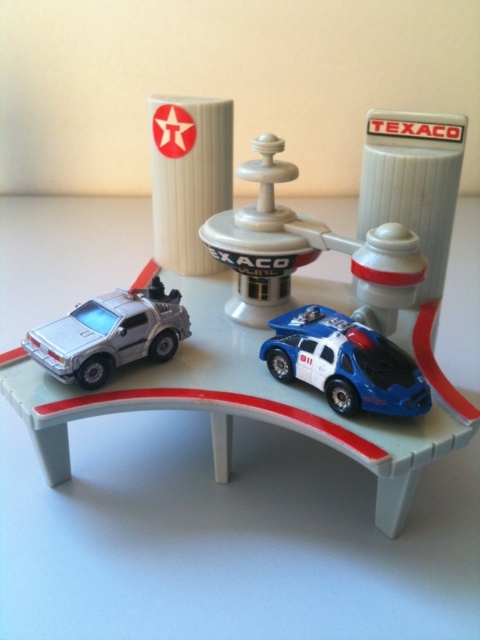
Does white plastic texaco gas station at center have a smaller size compared to blue glossy police car at center?

No, white plastic texaco gas station at center is not smaller than blue glossy police car at center.

Consider the image. Who is more forward, (240, 164) or (339, 355)?

Point (339, 355) is more forward.

At what (x,y) coordinates should I click in order to perform the action: click on white plastic texaco gas station at center. Please return your answer as a coordinate pair (x, y). Looking at the image, I should click on (305, 250).

Can you confirm if blue glossy police car at center is taller than silver metallic delorean at left?

In fact, blue glossy police car at center may be shorter than silver metallic delorean at left.

Does point (283, 328) lie behind point (98, 385)?

Yes, it is behind point (98, 385).

This screenshot has width=480, height=640. Find the location of `blue glossy police car at center`. blue glossy police car at center is located at coordinates (345, 364).

Measure the distance between white plastic track at center and camera.

white plastic track at center is 3.98 feet from camera.

Can you confirm if white plastic track at center is positioned to the left of blue glossy police car at center?

Yes, white plastic track at center is to the left of blue glossy police car at center.

Identify the location of white plastic track at center. (250, 401).